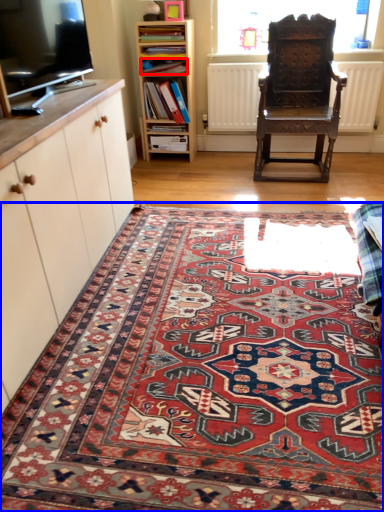
Question: Which point is further to the camera, book (highlighted by a red box) or mat (highlighted by a blue box)?

Choices:
 (A) book
 (B) mat

Answer: (A)